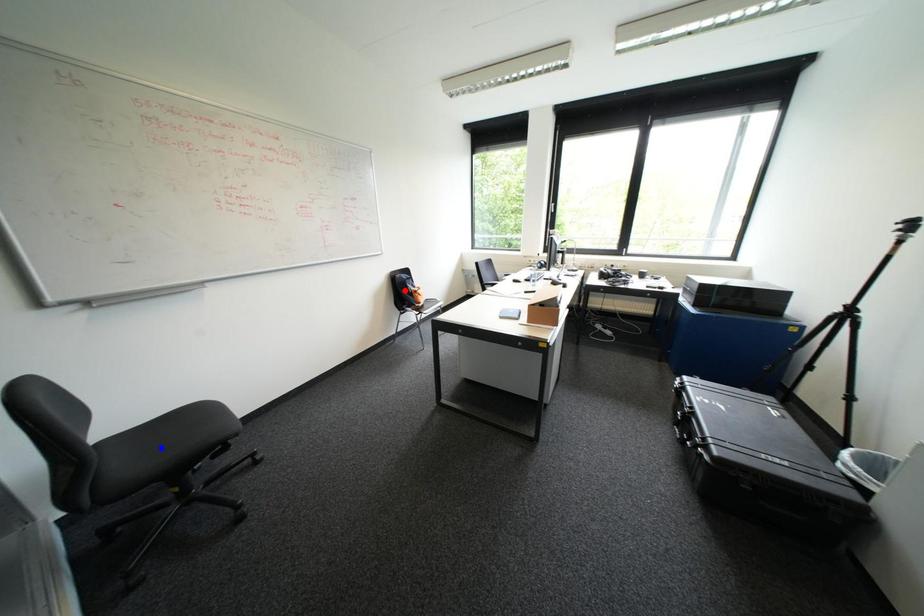
Question: Which of the two points in the image is closer to the camera?

Choices:
 (A) Blue point is closer.
 (B) Red point is closer.

Answer: (A)